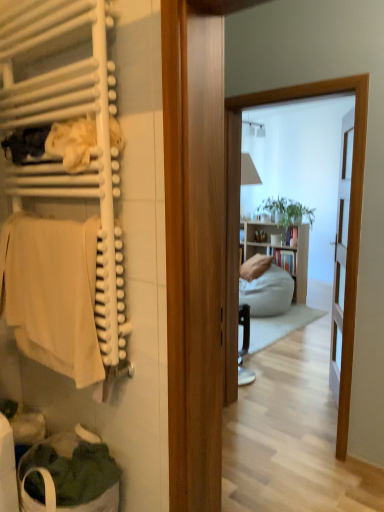
Question: Can you confirm if beige cotton towel at left is positioned to the left of white fabric laundry basket at lower left?

Choices:
 (A) no
 (B) yes

Answer: (B)

Question: Considering the relative sizes of beige cotton towel at left and white fabric laundry basket at lower left in the image provided, is beige cotton towel at left shorter than white fabric laundry basket at lower left?

Choices:
 (A) no
 (B) yes

Answer: (A)

Question: Is beige cotton towel at left in front of white fabric laundry basket at lower left?

Choices:
 (A) no
 (B) yes

Answer: (B)

Question: Does beige cotton towel at left lie behind white fabric laundry basket at lower left?

Choices:
 (A) no
 (B) yes

Answer: (A)

Question: Is white fabric laundry basket at lower left surrounded by beige cotton towel at left?

Choices:
 (A) no
 (B) yes

Answer: (A)

Question: Is beige cotton towel at left outside of white fabric laundry basket at lower left?

Choices:
 (A) yes
 (B) no

Answer: (A)

Question: Does white fabric laundry basket at lower left have a larger size compared to white matte towel rack at left?

Choices:
 (A) no
 (B) yes

Answer: (A)

Question: From a real-world perspective, is white fabric laundry basket at lower left physically above white matte towel rack at left?

Choices:
 (A) yes
 (B) no

Answer: (B)

Question: Can you confirm if white fabric laundry basket at lower left is positioned to the right of white matte towel rack at left?

Choices:
 (A) no
 (B) yes

Answer: (B)

Question: Can you confirm if white fabric laundry basket at lower left is wider than white matte towel rack at left?

Choices:
 (A) no
 (B) yes

Answer: (B)

Question: Is white fabric laundry basket at lower left thinner than white matte towel rack at left?

Choices:
 (A) yes
 (B) no

Answer: (B)

Question: Can you confirm if white fabric laundry basket at lower left is smaller than white matte towel rack at left?

Choices:
 (A) yes
 (B) no

Answer: (A)

Question: Does white matte towel rack at left have a lesser height compared to white fabric laundry basket at lower left?

Choices:
 (A) yes
 (B) no

Answer: (B)